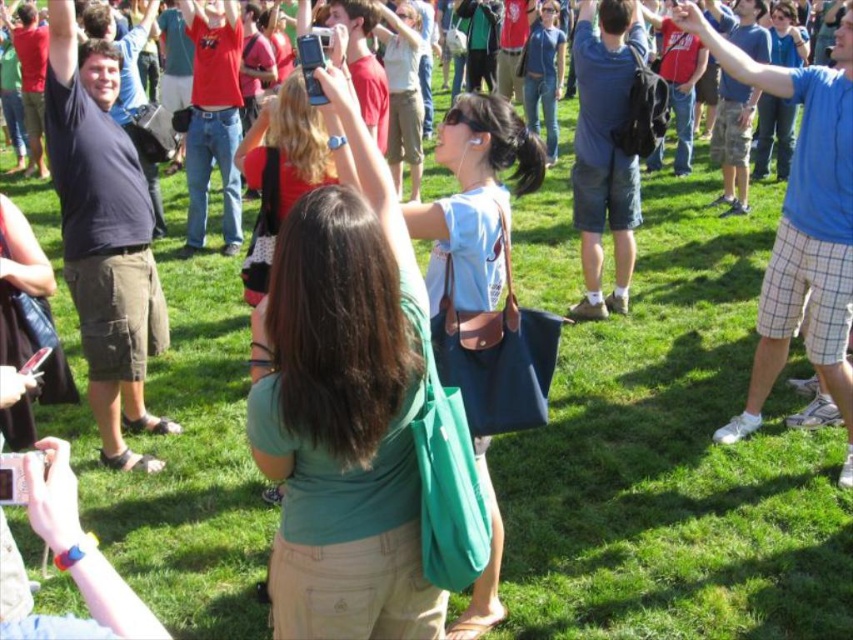
Question: Which of the following is the farthest from the observer?

Choices:
 (A) (756, 326)
 (B) (297, 336)

Answer: (A)

Question: Among these objects, which one is farthest from the camera?

Choices:
 (A) matte green bag at center
 (B) blue plaid shorts at right

Answer: (B)

Question: Which point is farther from the camera taking this photo?

Choices:
 (A) (767, 353)
 (B) (105, 202)
 (C) (585, 163)

Answer: (C)

Question: Can you confirm if matte green bag at center is wider than blue plaid shorts at right?

Choices:
 (A) no
 (B) yes

Answer: (A)

Question: Is dark blue shirt at left positioned in front of blue denim shorts at center?

Choices:
 (A) yes
 (B) no

Answer: (A)

Question: Is matte green bag at center below blue plaid shorts at right?

Choices:
 (A) no
 (B) yes

Answer: (B)